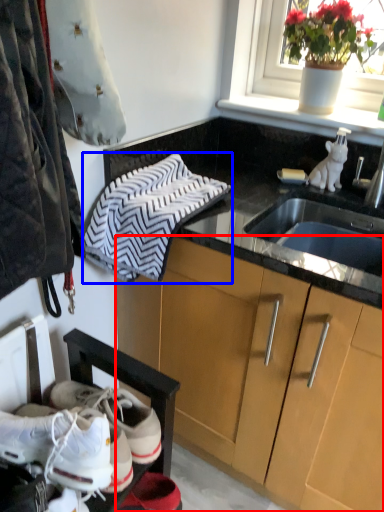
Question: Which of the following is the closest to the observer, cabinetry (highlighted by a red box) or hand towel (highlighted by a blue box)?

Choices:
 (A) cabinetry
 (B) hand towel

Answer: (A)